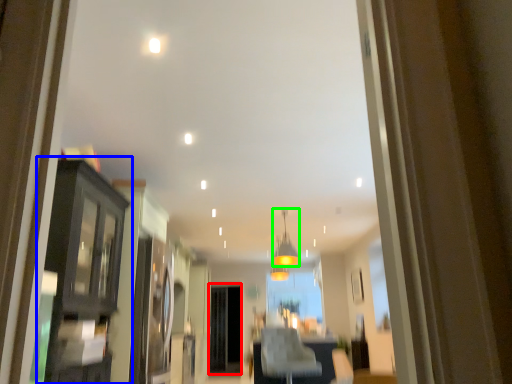
Question: Based on their relative distances, which object is farther from screen door (highlighted by a red box)? Choose from dresser (highlighted by a blue box) and light fixture (highlighted by a green box).

Choices:
 (A) dresser
 (B) light fixture

Answer: (A)